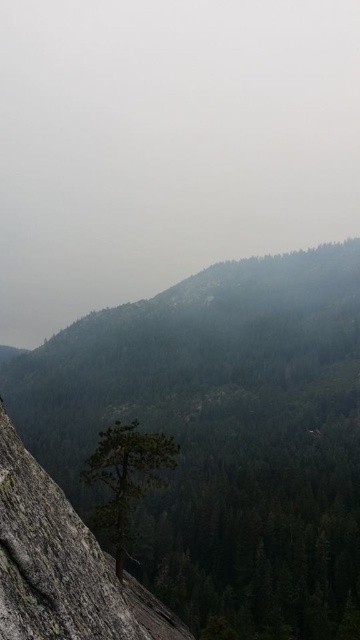
In the scene shown: Does green textured tree at center appear over gray rough rock at center?

Yes.

Can you confirm if green textured tree at center is smaller than gray rough rock at center?

Incorrect, green textured tree at center is not smaller in size than gray rough rock at center.

You are a GUI agent. You are given a task and a screenshot of the screen. Output one action in this format:
    pyautogui.click(x=<x>, y=<y>)
    Task: Click on the green textured tree at center
    The image size is (360, 640).
    Given the screenshot: What is the action you would take?
    pyautogui.click(x=223, y=435)